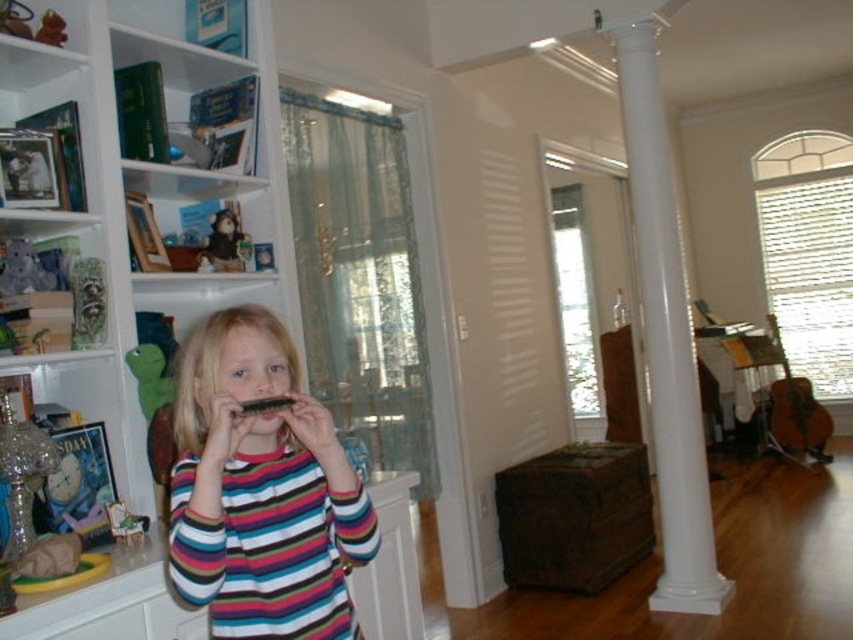
Question: Considering the relative positions of striped fabric child at center and velvety brown teddy bear at upper left in the image provided, where is striped fabric child at center located with respect to velvety brown teddy bear at upper left?

Choices:
 (A) below
 (B) above

Answer: (A)

Question: Does striped fabric child at center lie behind matte black harmonica at center?

Choices:
 (A) yes
 (B) no

Answer: (B)

Question: Can you confirm if white wood bookcase at left is positioned to the left of striped fabric child at center?

Choices:
 (A) no
 (B) yes

Answer: (B)

Question: Which point is closer to the camera?

Choices:
 (A) (142, 582)
 (B) (268, 513)
 (C) (676, 305)
 (D) (227, 241)

Answer: (B)

Question: Considering the real-world distances, which object is farthest from the striped fabric child at center?

Choices:
 (A) matte black harmonica at center
 (B) white smooth column at center
 (C) white wood bookcase at left
 (D) velvety brown teddy bear at upper left

Answer: (B)

Question: Considering the real-world distances, which object is closest to the white smooth column at center?

Choices:
 (A) matte black harmonica at center
 (B) striped fabric child at center
 (C) white wood bookcase at left
 (D) velvety brown teddy bear at upper left

Answer: (D)